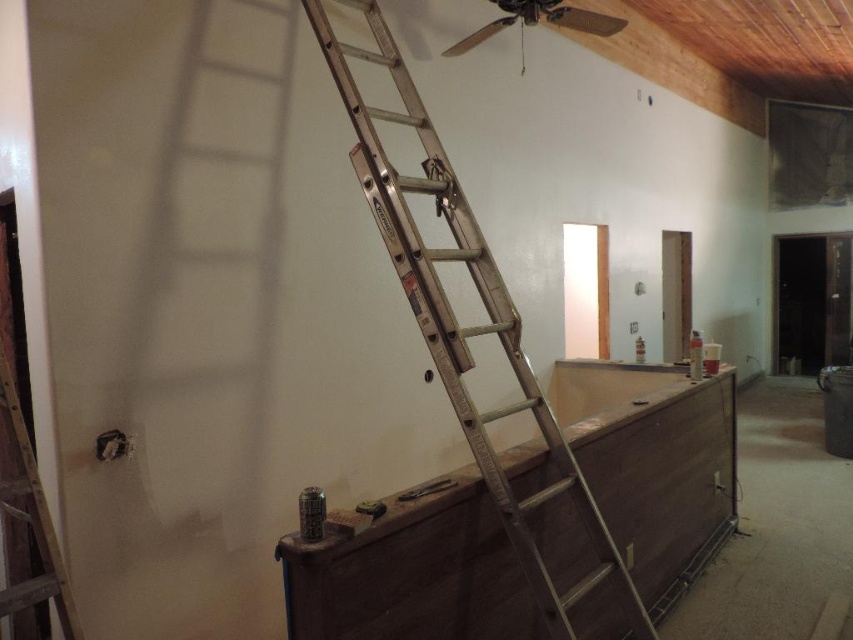
Question: Does brown wood dresser at center lie in front of metallic silver ladder at left?

Choices:
 (A) yes
 (B) no

Answer: (B)

Question: From the image, what is the correct spatial relationship of silver metallic ladder at center in relation to metallic silver ladder at left?

Choices:
 (A) below
 (B) above

Answer: (B)

Question: Which point appears closest to the camera in this image?

Choices:
 (A) (35, 577)
 (B) (473, 45)
 (C) (419, 538)
 (D) (463, 227)

Answer: (A)

Question: Does brown wood dresser at center appear over silver metallic ladder at center?

Choices:
 (A) yes
 (B) no

Answer: (B)

Question: Which object is closer to the camera taking this photo?

Choices:
 (A) brown wood dresser at center
 (B) metallic silver ladder at left
 (C) silver metallic ladder at center
 (D) metallic ceiling fan at upper center

Answer: (B)

Question: Which of the following is the farthest from the observer?

Choices:
 (A) (300, 624)
 (B) (3, 408)

Answer: (B)